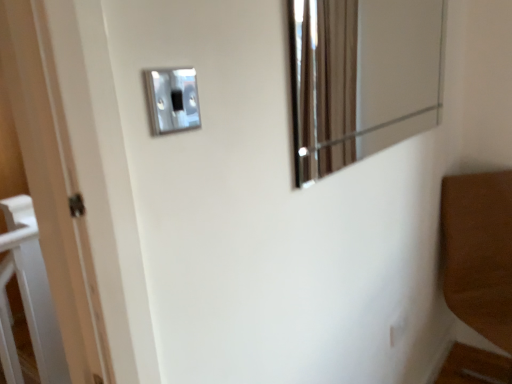
What do you see at coordinates (172, 100) in the screenshot?
I see `satin silver switch at upper center, which is the second light switch in right-to-left order` at bounding box center [172, 100].

In order to click on satin silver switch at upper center, positioned as the first light switch in bottom-to-top order in this screenshot , I will do `click(397, 330)`.

Considering the relative sizes of satin silver switch at upper center, the second light switch viewed from the top, and metallic reflective mirror at upper right in the image provided, is satin silver switch at upper center, the second light switch viewed from the top, wider than metallic reflective mirror at upper right?

In fact, satin silver switch at upper center, the second light switch viewed from the top, might be narrower than metallic reflective mirror at upper right.

Considering the sizes of satin silver switch at upper center, positioned as the first light switch in bottom-to-top order, and metallic reflective mirror at upper right in the image, is satin silver switch at upper center, positioned as the first light switch in bottom-to-top order, taller or shorter than metallic reflective mirror at upper right?

In the image, satin silver switch at upper center, positioned as the first light switch in bottom-to-top order, appears to be shorter than metallic reflective mirror at upper right.

How many degrees apart are the facing directions of satin silver switch at upper center, the 1th light switch from the right, and metallic reflective mirror at upper right?

They differ by 0.579 degrees in their facing directions.

Which object is more forward, satin silver switch at upper center, the 1th light switch from the right, or metallic reflective mirror at upper right?

Positioned in front is metallic reflective mirror at upper right.

What's the angular difference between metallic reflective mirror at upper right and satin silver switch at upper center, marked as the 2th light switch in a bottom-to-top arrangement,'s facing directions?

metallic reflective mirror at upper right and satin silver switch at upper center, marked as the 2th light switch in a bottom-to-top arrangement, are facing 0.613 degrees away from each other.

I want to click on the 1st light switch positioned below the metallic reflective mirror at upper right (from a real-world perspective), so click(x=172, y=100).

Is the depth of metallic reflective mirror at upper right greater than that of satin silver switch at upper center, the 2th light switch positioned from the back?

Yes, the depth of metallic reflective mirror at upper right is greater than that of satin silver switch at upper center, the 2th light switch positioned from the back.

From the image's perspective, is metallic reflective mirror at upper right positioned above or below satin silver switch at upper center, the first light switch positioned from the front?

Clearly, from the image's perspective, metallic reflective mirror at upper right is above satin silver switch at upper center, the first light switch positioned from the front.

From a real-world perspective, which object rests below the other?

satin silver switch at upper center, the 2th light switch when ordered from left to right, is physically lower.

In order to click on mirror located above the satin silver switch at upper center, which is the first light switch from back to front (from a real-world perspective) in this screenshot , I will do `click(362, 78)`.

Considering the positions of objects metallic reflective mirror at upper right and satin silver switch at upper center, the 2th light switch when ordered from left to right, in the image provided, who is more to the left, metallic reflective mirror at upper right or satin silver switch at upper center, the 2th light switch when ordered from left to right,?

Positioned to the left is metallic reflective mirror at upper right.

Is satin silver switch at upper center, which is the 2th light switch from front to back, at the back of metallic reflective mirror at upper right?

No, metallic reflective mirror at upper right is not facing the opposite direction of satin silver switch at upper center, which is the 2th light switch from front to back.

From the picture: Is satin silver switch at upper center, which is the first light switch from back to front, far from satin silver switch at upper center, which appears as the 1th light switch when viewed from the left?

Yes, satin silver switch at upper center, which is the first light switch from back to front, and satin silver switch at upper center, which appears as the 1th light switch when viewed from the left, are quite far apart.

Can you confirm if satin silver switch at upper center, which is the first light switch from back to front, is thinner than satin silver switch at upper center, the 2th light switch positioned from the back?

Correct, the width of satin silver switch at upper center, which is the first light switch from back to front, is less than that of satin silver switch at upper center, the 2th light switch positioned from the back.

Is satin silver switch at upper center, the second light switch viewed from the top, facing away from satin silver switch at upper center, which is the second light switch in right-to-left order?

No, satin silver switch at upper center, the second light switch viewed from the top,'s orientation is not away from satin silver switch at upper center, which is the second light switch in right-to-left order.

How many degrees apart are the facing directions of satin silver switch at upper center, the 2th light switch when ordered from left to right, and satin silver switch at upper center, which appears as the 1th light switch when viewed from the left?

satin silver switch at upper center, the 2th light switch when ordered from left to right, and satin silver switch at upper center, which appears as the 1th light switch when viewed from the left, are facing 0.0354 degrees away from each other.

Is satin silver switch at upper center, marked as the 2th light switch in a bottom-to-top arrangement, bigger or smaller than metallic reflective mirror at upper right?

In the image, satin silver switch at upper center, marked as the 2th light switch in a bottom-to-top arrangement, appears to be smaller than metallic reflective mirror at upper right.

How different are the orientations of satin silver switch at upper center, the 2th light switch positioned from the back, and metallic reflective mirror at upper right in degrees?

satin silver switch at upper center, the 2th light switch positioned from the back, and metallic reflective mirror at upper right are facing 0.613 degrees away from each other.

Considering the relative positions of satin silver switch at upper center, which is the second light switch in right-to-left order, and metallic reflective mirror at upper right in the image provided, is satin silver switch at upper center, which is the second light switch in right-to-left order, behind metallic reflective mirror at upper right?

No.

Who is shorter, satin silver switch at upper center, the 2th light switch positioned from the back, or metallic reflective mirror at upper right?

satin silver switch at upper center, the 2th light switch positioned from the back.

From a real-world perspective, between satin silver switch at upper center, the 2th light switch positioned from the back, and satin silver switch at upper center, the 2th light switch when ordered from left to right, who is vertically lower?

satin silver switch at upper center, the 2th light switch when ordered from left to right.

Is satin silver switch at upper center, the first light switch positioned from the front, placed right next to satin silver switch at upper center, which is the first light switch from back to front?

No, satin silver switch at upper center, the first light switch positioned from the front, is not beside satin silver switch at upper center, which is the first light switch from back to front.

In the image, is satin silver switch at upper center, the first light switch positioned from the front, positioned in front of or behind satin silver switch at upper center, which is the first light switch from back to front?

satin silver switch at upper center, the first light switch positioned from the front, is in front of satin silver switch at upper center, which is the first light switch from back to front.

Which object is positioned more to the right, satin silver switch at upper center, the 2th light switch positioned from the back, or satin silver switch at upper center, the 1th light switch from the right?

From the viewer's perspective, satin silver switch at upper center, the 1th light switch from the right, appears more on the right side.

You are a GUI agent. You are given a task and a screenshot of the screen. Output one action in this format:
    pyautogui.click(x=<x>, y=<y>)
    Task: Click on the mirror above the satin silver switch at upper center, which is the first light switch from back to front (from a real-world perspective)
    
    Given the screenshot: What is the action you would take?
    pyautogui.click(x=362, y=78)

Locate an element on the screen. mirror on the right of satin silver switch at upper center, the first light switch positioned from the front is located at coordinates (362, 78).

Which object lies further to the anchor point satin silver switch at upper center, which is the 2th light switch from front to back, metallic reflective mirror at upper right or satin silver switch at upper center, the 1th light switch in the top-to-bottom sequence?

Among the two, satin silver switch at upper center, the 1th light switch in the top-to-bottom sequence, is located further to satin silver switch at upper center, which is the 2th light switch from front to back.

Looking at the image, which one is located closer to satin silver switch at upper center, which is the second light switch in right-to-left order, satin silver switch at upper center, which is the first light switch from back to front, or metallic reflective mirror at upper right?

satin silver switch at upper center, which is the first light switch from back to front, lies closer to satin silver switch at upper center, which is the second light switch in right-to-left order, than the other object.

Based on their spatial positions, is satin silver switch at upper center, marked as the 2th light switch in a bottom-to-top arrangement, or satin silver switch at upper center, positioned as the first light switch in bottom-to-top order, closer to metallic reflective mirror at upper right?

Based on the image, satin silver switch at upper center, positioned as the first light switch in bottom-to-top order, appears to be nearer to metallic reflective mirror at upper right.

Considering their positions, is metallic reflective mirror at upper right positioned further to satin silver switch at upper center, which is the second light switch in right-to-left order, than satin silver switch at upper center, the second light switch viewed from the top?

metallic reflective mirror at upper right.

Estimate the real-world distances between objects in this image. Which object is closer to metallic reflective mirror at upper right, satin silver switch at upper center, positioned as the first light switch in bottom-to-top order, or satin silver switch at upper center, the 1th light switch in the top-to-bottom sequence?

Based on the image, satin silver switch at upper center, positioned as the first light switch in bottom-to-top order, appears to be nearer to metallic reflective mirror at upper right.

Considering their positions, is satin silver switch at upper center, the first light switch positioned from the front, positioned closer to satin silver switch at upper center, which is the 2th light switch from front to back, than metallic reflective mirror at upper right?

Among the two, metallic reflective mirror at upper right is located nearer to satin silver switch at upper center, which is the 2th light switch from front to back.

Locate an element on the screen. The height and width of the screenshot is (384, 512). mirror located between satin silver switch at upper center, the first light switch positioned from the front, and satin silver switch at upper center, positioned as the first light switch in bottom-to-top order, in the depth direction is located at coordinates (362, 78).